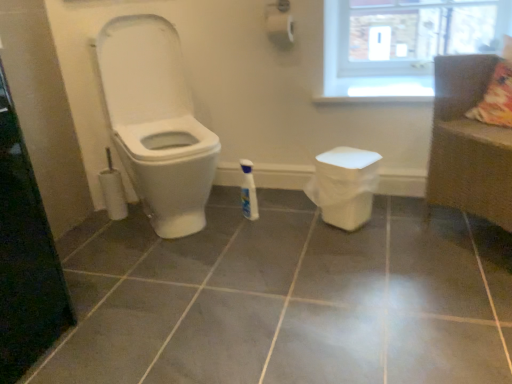
Identify the location of gray glossy tile at center. The image size is (512, 384). (289, 299).

In order to face white glossy toilet at left, should I rotate leftwards or rightwards?

It's best to rotate left around 12.864 degrees.

Locate an element on the screen. This screenshot has width=512, height=384. gray glossy tile at center is located at coordinates (289, 299).

Which object is further away from the camera, transparent glass screen door at left or white glossy toilet at left?

Positioned behind is white glossy toilet at left.

In the scene shown: Does transparent glass screen door at left appear on the right side of white glossy toilet at left?

No.

Which of these two, transparent glass screen door at left or white glossy toilet at left, is thinner?

transparent glass screen door at left.

Where is `screen door in front of the white glossy toilet at left`? The height and width of the screenshot is (384, 512). screen door in front of the white glossy toilet at left is located at coordinates (25, 257).

I want to click on ceramic tile below the transparent glass screen door at left (from a real-world perspective), so click(x=289, y=299).

Is point (41, 284) positioned after point (469, 348)?

That is True.

Is transparent glass screen door at left further to the viewer compared to gray glossy tile at center?

Yes, it is behind gray glossy tile at center.

Based on their positions, is gray glossy tile at center located to the left or right of transparent glass window at upper right?

Based on their positions, gray glossy tile at center is located to the left of transparent glass window at upper right.

Considering the relative sizes of gray glossy tile at center and transparent glass window at upper right in the image provided, is gray glossy tile at center thinner than transparent glass window at upper right?

Incorrect, the width of gray glossy tile at center is not less than that of transparent glass window at upper right.

In the image, is gray glossy tile at center positioned in front of or behind transparent glass window at upper right?

gray glossy tile at center is positioned closer to the viewer than transparent glass window at upper right.

Locate an element on the screen. ceramic tile on the left of transparent glass window at upper right is located at coordinates [289, 299].

From a real-world perspective, which is physically above, white glossy toilet at left or white glossy bottle at center?

In real-world perspective, white glossy toilet at left is above.

Considering the relative sizes of white glossy toilet at left and white glossy bottle at center in the image provided, is white glossy toilet at left shorter than white glossy bottle at center?

In fact, white glossy toilet at left may be taller than white glossy bottle at center.

Looking at this image, is white glossy toilet at left aimed at white glossy bottle at center?

Result: No.

Does white glossy toilet at left lie behind white glossy bottle at center?

No, the depth of white glossy toilet at left is less than that of white glossy bottle at center.

You are a GUI agent. You are given a task and a screenshot of the screen. Output one action in this format:
    pyautogui.click(x=<x>, y=<y>)
    Task: Click on the couch above the white glossy bottle at center (from the image's perspective)
    
    Given the screenshot: What is the action you would take?
    pyautogui.click(x=468, y=144)

Is white glossy bottle at center not within brown woven couch at right?

Absolutely, white glossy bottle at center is external to brown woven couch at right.

Based on the photo, is white glossy bottle at center looking in the opposite direction of brown woven couch at right?

No, brown woven couch at right is not at the back of white glossy bottle at center.

Can you confirm if white glossy bottle at center is thinner than brown woven couch at right?

Correct, the width of white glossy bottle at center is less than that of brown woven couch at right.

Measure the distance between gray glossy tile at center and white glossy bottle at center.

gray glossy tile at center is 24.72 inches from white glossy bottle at center.

Are gray glossy tile at center and white glossy bottle at center beside each other?

gray glossy tile at center and white glossy bottle at center are clearly separated.

Is gray glossy tile at center situated inside white glossy bottle at center or outside?

gray glossy tile at center is spatially situated outside white glossy bottle at center.

The width and height of the screenshot is (512, 384). I want to click on cleaning product that is above the gray glossy tile at center (from a real-world perspective), so click(x=248, y=191).

Which point is more distant from viewer, (432, 50) or (432, 195)?

The point (432, 50) is more distant.

In the image, is transparent glass window at upper right on the left side or the right side of brown woven couch at right?

In the image, transparent glass window at upper right appears on the left side of brown woven couch at right.

Can you see transparent glass window at upper right touching brown woven couch at right?

There is a gap between transparent glass window at upper right and brown woven couch at right.

Does transparent glass window at upper right come in front of brown woven couch at right?

No, the depth of transparent glass window at upper right is greater than that of brown woven couch at right.

Locate an element on the screen. screen door located underneath the white glossy toilet at left (from a real-world perspective) is located at coordinates (25, 257).

Identify the location of screen door that is on the left side of gray glossy tile at center. (25, 257).

Based on their spatial positions, is transparent glass screen door at left or brown woven couch at right further from gray glossy tile at center?

transparent glass screen door at left is further to gray glossy tile at center.

Estimate the real-world distances between objects in this image. Which object is closer to transparent glass window at upper right, transparent glass screen door at left or gray glossy tile at center?

gray glossy tile at center is closer to transparent glass window at upper right.

Considering their positions, is brown woven couch at right positioned closer to gray glossy tile at center than transparent glass window at upper right?

brown woven couch at right lies closer to gray glossy tile at center than the other object.

Based on their spatial positions, is brown woven couch at right or transparent glass window at upper right further from transparent glass screen door at left?

The object further to transparent glass screen door at left is transparent glass window at upper right.

When comparing their distances from brown woven couch at right, does transparent glass window at upper right or white glossy toilet at left seem closer?

transparent glass window at upper right lies closer to brown woven couch at right than the other object.

Which object lies further to the anchor point transparent glass window at upper right, gray glossy tile at center or white glossy bottle at center?

gray glossy tile at center is further to transparent glass window at upper right.

Considering their positions, is white glossy bottle at center positioned further to gray glossy tile at center than transparent glass screen door at left?

white glossy bottle at center lies further to gray glossy tile at center than the other object.

Considering their positions, is white glossy toilet at left positioned further to transparent glass window at upper right than white glossy bottle at center?

white glossy toilet at left is positioned further to the anchor transparent glass window at upper right.

In order to click on couch located between gray glossy tile at center and transparent glass window at upper right in the depth direction in this screenshot , I will do `click(468, 144)`.

The width and height of the screenshot is (512, 384). Identify the location of toilet between transparent glass screen door at left and gray glossy tile at center. (156, 122).

At what (x,y) coordinates should I click in order to perform the action: click on cleaning product situated between white glossy toilet at left and brown woven couch at right from left to right. Please return your answer as a coordinate pair (x, y). The width and height of the screenshot is (512, 384). Looking at the image, I should click on (248, 191).

The height and width of the screenshot is (384, 512). What are the coordinates of `toilet located between gray glossy tile at center and white glossy bottle at center in the depth direction` in the screenshot? It's located at (156, 122).